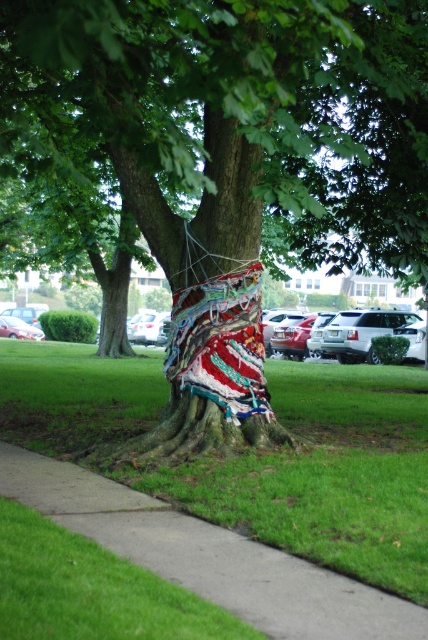
Question: Which point appears closest to the camera in this image?

Choices:
 (A) (321, 424)
 (B) (155, 225)

Answer: (B)

Question: Can you confirm if knitted fabric tree at center is smaller than green grass at lower center?

Choices:
 (A) no
 (B) yes

Answer: (A)

Question: Is knitted fabric tree at center thinner than green grass at lower center?

Choices:
 (A) no
 (B) yes

Answer: (B)

Question: Is knitted fabric tree at center to the left of green grass at lower center from the viewer's perspective?

Choices:
 (A) no
 (B) yes

Answer: (B)

Question: Among these points, which one is nearest to the camera?

Choices:
 (A) (184, 61)
 (B) (419, 410)

Answer: (A)